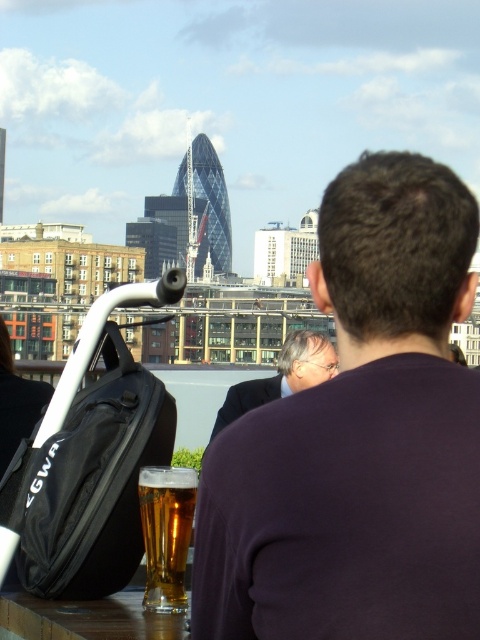
Question: Among these objects, which one is nearest to the camera?

Choices:
 (A) dark suit at center
 (B) translucent glass at lower center
 (C) dark purple shirt at center

Answer: (C)

Question: Which object appears closest to the camera in this image?

Choices:
 (A) dark suit at center
 (B) translucent glass at lower center
 (C) dark purple shirt at center

Answer: (C)

Question: Does dark purple shirt at center appear under dark suit at center?

Choices:
 (A) no
 (B) yes

Answer: (A)

Question: Among these points, which one is nearest to the camera?

Choices:
 (A) (233, 410)
 (B) (194, 481)

Answer: (B)

Question: Considering the relative positions of translucent glass at lower center and dark suit at center in the image provided, where is translucent glass at lower center located with respect to dark suit at center?

Choices:
 (A) above
 (B) below

Answer: (B)

Question: Can you confirm if dark purple shirt at center is positioned above dark suit at center?

Choices:
 (A) no
 (B) yes

Answer: (B)